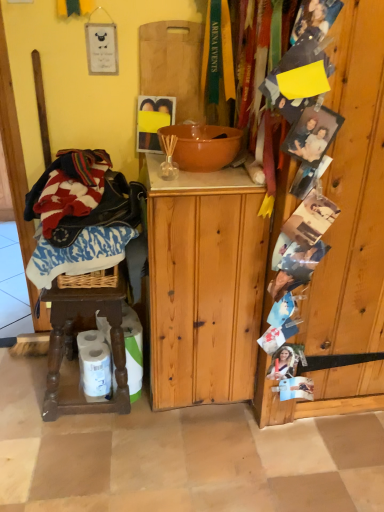
At what (x,y) coordinates should I click in order to perform the action: click on free location above orange ceramic bowl at center (from a real-world perspective). Please return your answer as a coordinate pair (x, y). This screenshot has height=512, width=384. Looking at the image, I should click on (201, 130).